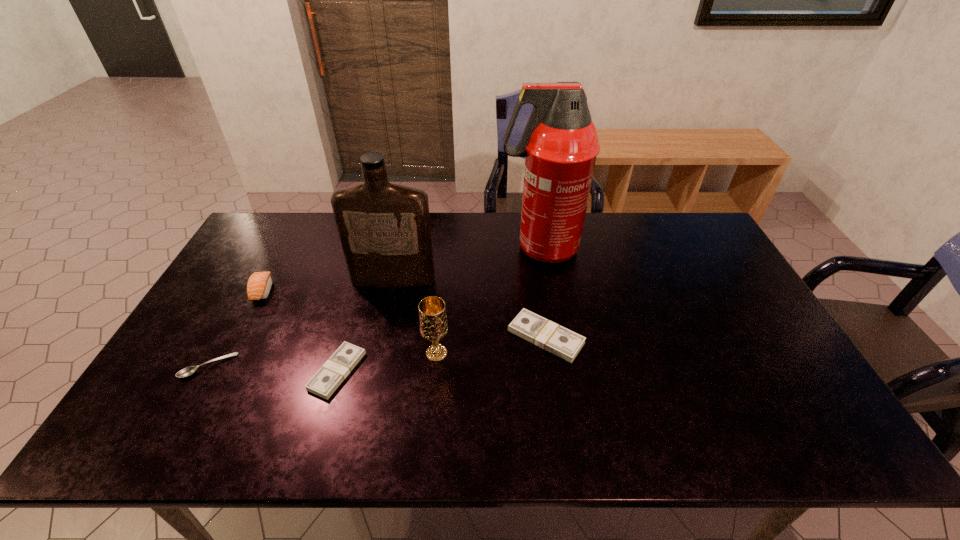
Where is `vacant space located on the back of the shorter dollar`? vacant space located on the back of the shorter dollar is located at coordinates (359, 295).

Locate an element on the screen. This screenshot has width=960, height=540. vacant point located 0.280m on the back of the taller dollar is located at coordinates (534, 252).

Locate an element on the screen. vacant area located 0.120m on the trigger side of the farthest object is located at coordinates (464, 248).

Locate an element on the screen. The height and width of the screenshot is (540, 960). free spot located 0.330m on the trigger side of the farthest object is located at coordinates (402, 248).

This screenshot has height=540, width=960. I want to click on vacant space located on the trigger side of the farthest object, so click(x=384, y=248).

What are the coordinates of `free space located 0.170m on the back of the sushi` in the screenshot? It's located at (287, 244).

Where is `vacant space located on the back of the shortest object`? vacant space located on the back of the shortest object is located at coordinates (242, 307).

Locate an element on the screen. free space located 0.160m on the label side of the second tallest object is located at coordinates (383, 329).

This screenshot has width=960, height=540. In order to click on blank space located 0.100m on the front of the chalice in this screenshot , I will do `click(432, 398)`.

Where is `object situated at the far edge`? The height and width of the screenshot is (540, 960). object situated at the far edge is located at coordinates (560, 144).